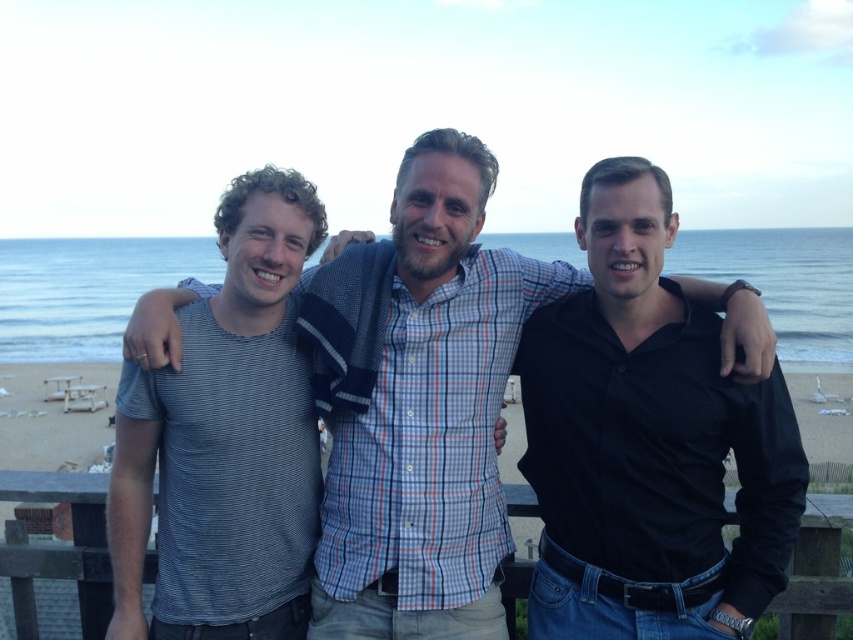
Question: Which point is farther to the camera?

Choices:
 (A) black smooth shirt at right
 (B) striped cotton shirt at center

Answer: (B)

Question: Does striped cotton shirt at center lie behind striped cotton t-shirt at left?

Choices:
 (A) yes
 (B) no

Answer: (A)

Question: Among these objects, which one is nearest to the camera?

Choices:
 (A) striped cotton t-shirt at left
 (B) striped cotton shirt at center
 (C) black smooth shirt at right
 (D) beige sand at lower center

Answer: (C)

Question: Considering the real-world distances, which object is closest to the striped cotton t-shirt at left?

Choices:
 (A) beige sand at lower center
 (B) striped cotton shirt at center

Answer: (B)

Question: Is black smooth shirt at right below striped cotton t-shirt at left?

Choices:
 (A) yes
 (B) no

Answer: (B)

Question: Is striped cotton t-shirt at left below beige sand at lower center?

Choices:
 (A) yes
 (B) no

Answer: (B)